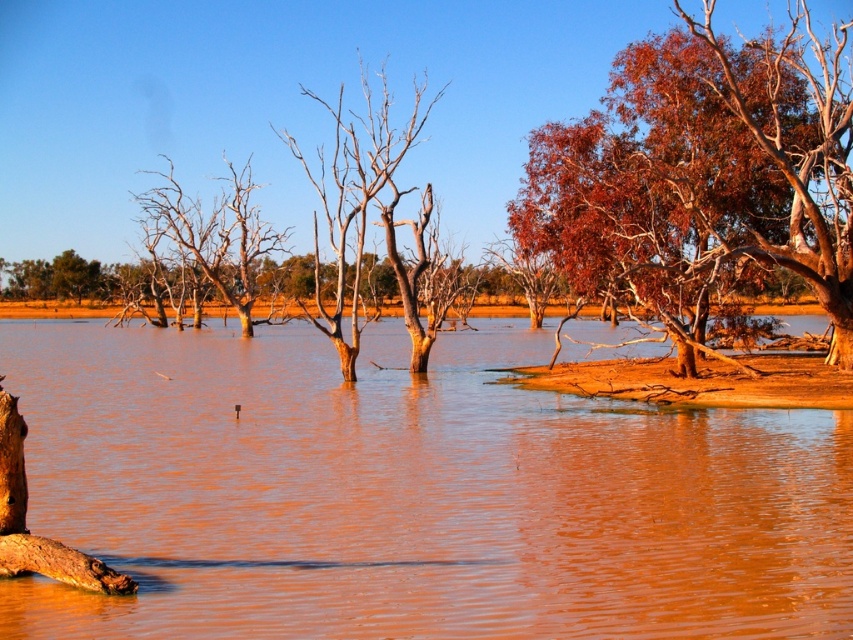
Question: Is brown muddy water at center behind brown bark tree at left?

Choices:
 (A) no
 (B) yes

Answer: (A)

Question: Estimate the real-world distances between objects in this image. Which object is farther from the smooth bark tree at center?

Choices:
 (A) brown bark tree at left
 (B) brown muddy water at center

Answer: (B)

Question: Which of the following is the farthest from the observer?

Choices:
 (A) smooth bark tree at center
 (B) reddish-brown bark tree at upper right

Answer: (A)

Question: Can you confirm if brown muddy water at center is positioned above reddish-brown bark tree at upper right?

Choices:
 (A) yes
 (B) no

Answer: (B)

Question: Which point appears closest to the camera in this image?

Choices:
 (A) (561, 198)
 (B) (254, 259)
 (C) (404, 320)

Answer: (C)

Question: Is smooth bark tree at center further to the viewer compared to brown bark tree at left?

Choices:
 (A) yes
 (B) no

Answer: (B)